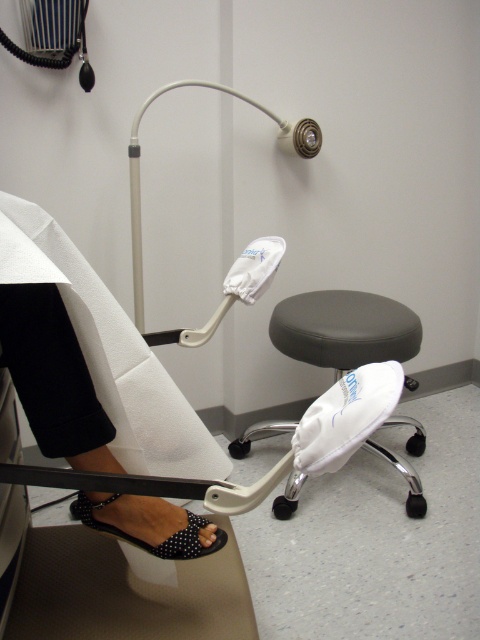
Is white fabric leg at lower left closer to the viewer compared to black leather stool at center?

That is True.

Is white fabric leg at lower left above black leather stool at center?

No.

You are a GUI agent. You are given a task and a screenshot of the screen. Output one action in this format:
    pyautogui.click(x=<x>, y=<y>)
    Task: Click on the white fabric leg at lower left
    The width and height of the screenshot is (480, 640).
    Given the screenshot: What is the action you would take?
    pyautogui.click(x=85, y=360)

Is black leather stool at center shorter than black dotted fabric sandal at lower left?

In fact, black leather stool at center may be taller than black dotted fabric sandal at lower left.

Can you confirm if black leather stool at center is wider than black dotted fabric sandal at lower left?

Yes, black leather stool at center is wider than black dotted fabric sandal at lower left.

Find the location of a particular element. The image size is (480, 640). black leather stool at center is located at coordinates (344, 328).

At what (x,y) coordinates should I click in order to perform the action: click on white fabric leg at lower left. Please return your answer as a coordinate pair (x, y). The width and height of the screenshot is (480, 640). Looking at the image, I should click on (85, 360).

Who is more distant from viewer, (x=139, y=522) or (x=196, y=518)?

The point (x=196, y=518) is behind.

At what (x,y) coordinates should I click in order to perform the action: click on white fabric leg at lower left. Please return your answer as a coordinate pair (x, y). Image resolution: width=480 pixels, height=640 pixels. Looking at the image, I should click on (85, 360).